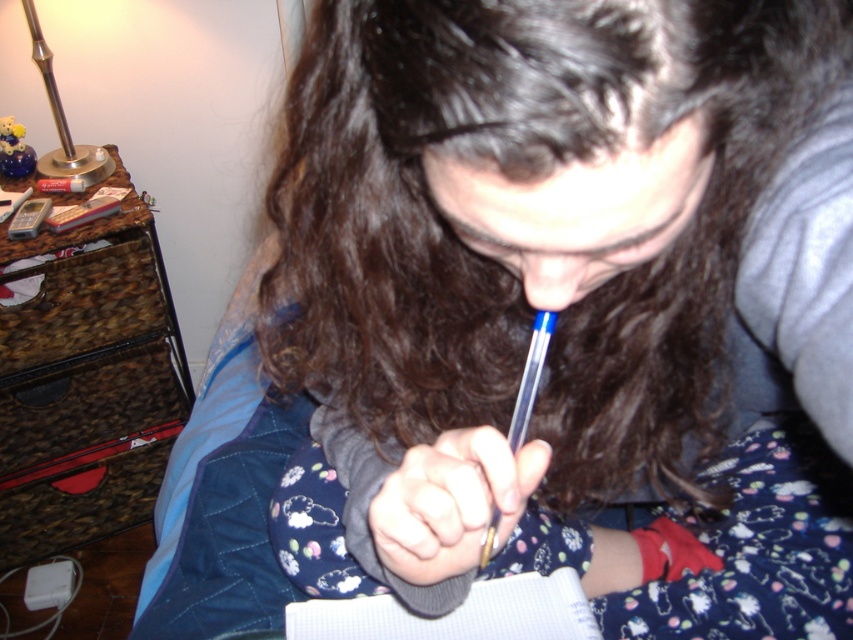
Question: Which is nearer to the white paper notebook at center?

Choices:
 (A) brown marble drawer at left
 (B) brown marble dresser at left

Answer: (A)

Question: Which object is positioned farthest from the brown marble dresser at left?

Choices:
 (A) metallic blue pen at center
 (B) brown marble drawer at left
 (C) white paper notebook at center

Answer: (C)

Question: Does brown marble dresser at left appear on the left side of brown marble drawer at left?

Choices:
 (A) no
 (B) yes

Answer: (B)

Question: Can you confirm if brown marble drawer at left is wider than white paper notebook at center?

Choices:
 (A) no
 (B) yes

Answer: (B)

Question: Which object is positioned farthest from the brown marble dresser at left?

Choices:
 (A) metallic blue pen at center
 (B) brown marble drawer at left

Answer: (A)

Question: In this image, where is brown marble dresser at left located relative to brown marble drawer at left?

Choices:
 (A) above
 (B) below

Answer: (B)